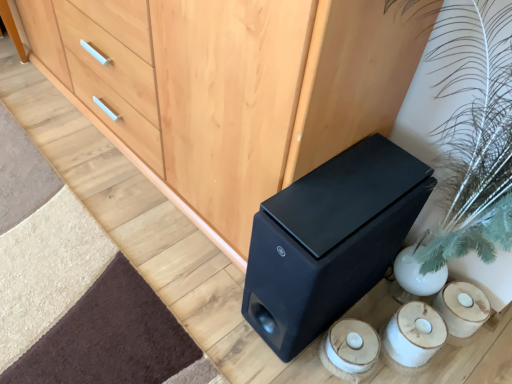
Find the location of a particular element. blank space situated above matte black speaker at lower right (from a real-world perspective) is located at coordinates (355, 188).